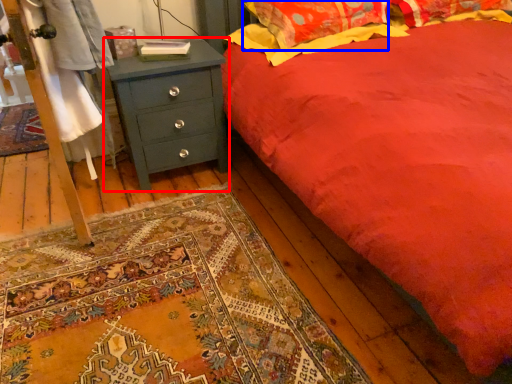
Question: Among these objects, which one is nearest to the camera, chest of drawers (highlighted by a red box) or pillow (highlighted by a blue box)?

Choices:
 (A) chest of drawers
 (B) pillow

Answer: (A)